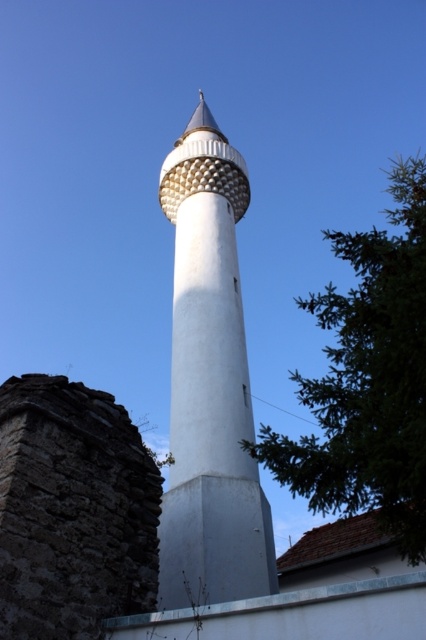
Between white smooth minaret at center and green leafy tree at center right, which one appears on the right side from the viewer's perspective?

Positioned to the right is green leafy tree at center right.

Which is more to the left, white smooth minaret at center or green leafy tree at center right?

Positioned to the left is white smooth minaret at center.

The width and height of the screenshot is (426, 640). Describe the element at coordinates (210, 385) in the screenshot. I see `white smooth minaret at center` at that location.

The width and height of the screenshot is (426, 640). What are the coordinates of `white smooth minaret at center` in the screenshot? It's located at tap(210, 385).